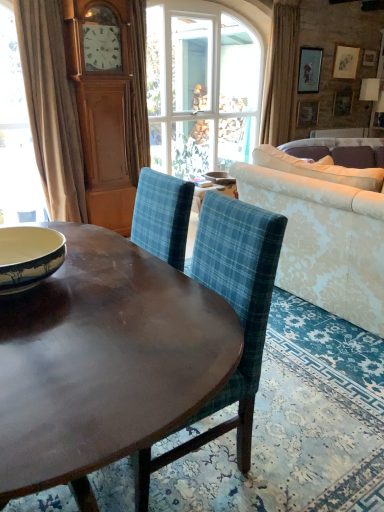
Where is `vacant area that is situated to the right of blue plaid fabric chair at center`? The height and width of the screenshot is (512, 384). vacant area that is situated to the right of blue plaid fabric chair at center is located at coordinates (304, 446).